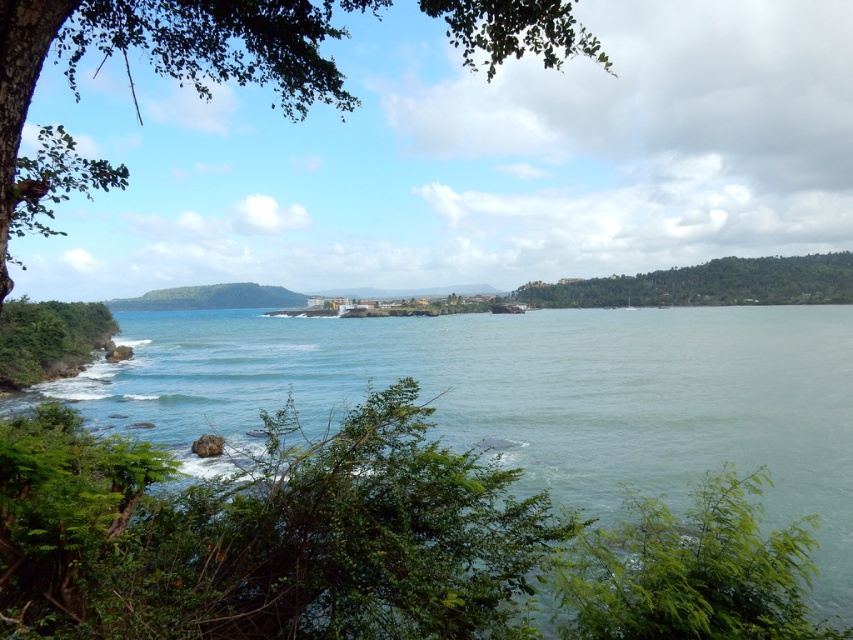
From the picture: Is the position of green leafy shrub at lower right more distant than that of green leafy tree at right?

No.

From the picture: Does green leafy shrub at lower right appear on the left side of green leafy tree at right?

Yes, green leafy shrub at lower right is to the left of green leafy tree at right.

The height and width of the screenshot is (640, 853). Identify the location of green leafy shrub at lower right. (691, 572).

You are a GUI agent. You are given a task and a screenshot of the screen. Output one action in this format:
    pyautogui.click(x=<x>, y=<y>)
    Task: Click on the green leafy shrub at lower right
    
    Given the screenshot: What is the action you would take?
    pyautogui.click(x=691, y=572)

Describe the element at coordinates (154, 72) in the screenshot. I see `green leafy tree at upper left` at that location.

The image size is (853, 640). I want to click on green leafy tree at upper left, so click(154, 72).

Is clear blue water at center bigger than green leafy shrub at lower right?

Correct, clear blue water at center is larger in size than green leafy shrub at lower right.

Which of these two, clear blue water at center or green leafy shrub at lower right, stands taller?

clear blue water at center is taller.

Who is more distant from viewer, (263,381) or (842,636)?

Positioned behind is point (263,381).

Locate an element on the screen. The height and width of the screenshot is (640, 853). clear blue water at center is located at coordinates (532, 396).